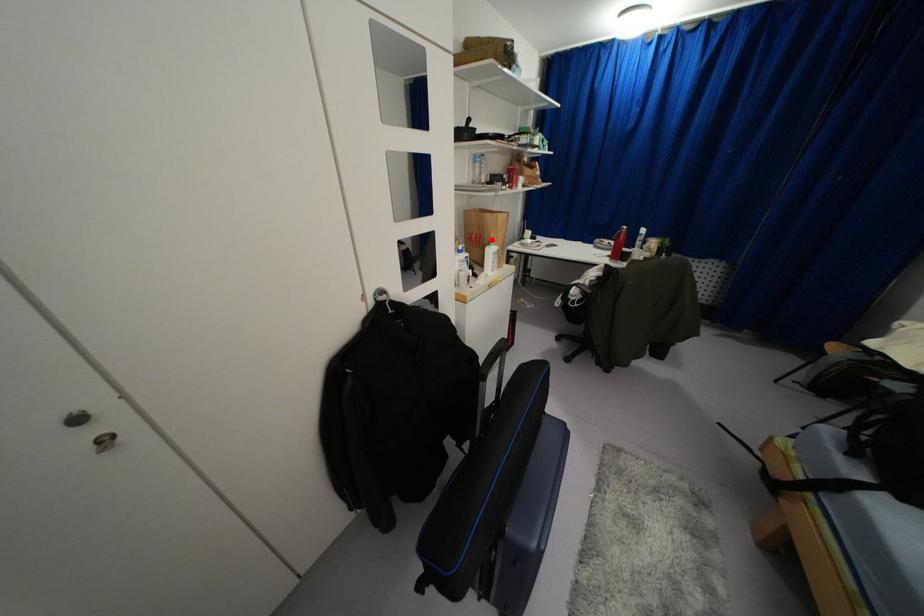
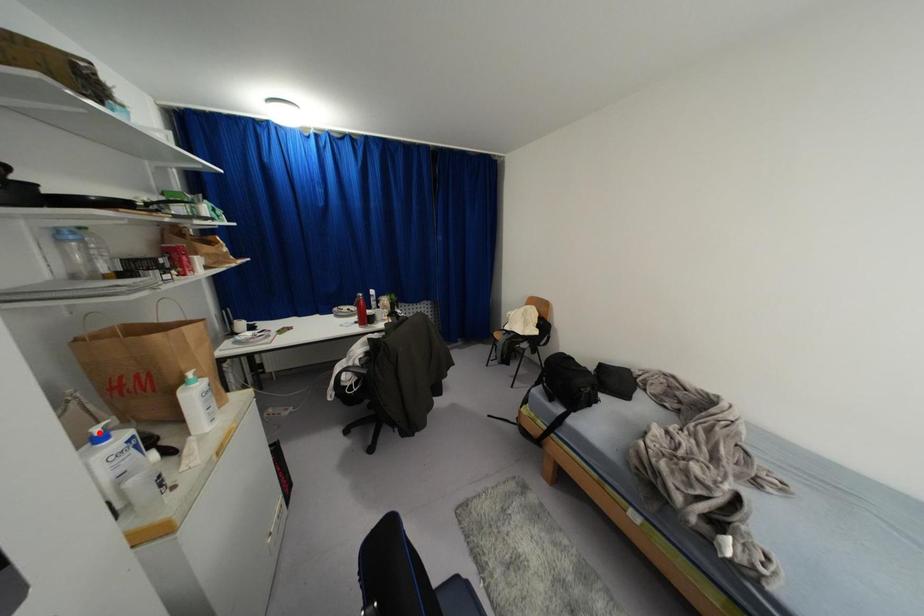
From the picture: I am providing you with two images of the same scene from different viewpoints. A red point is marked on the first image and another point is marked on the second image. Is the red point in image1 aligned with the point shown in image2?

No